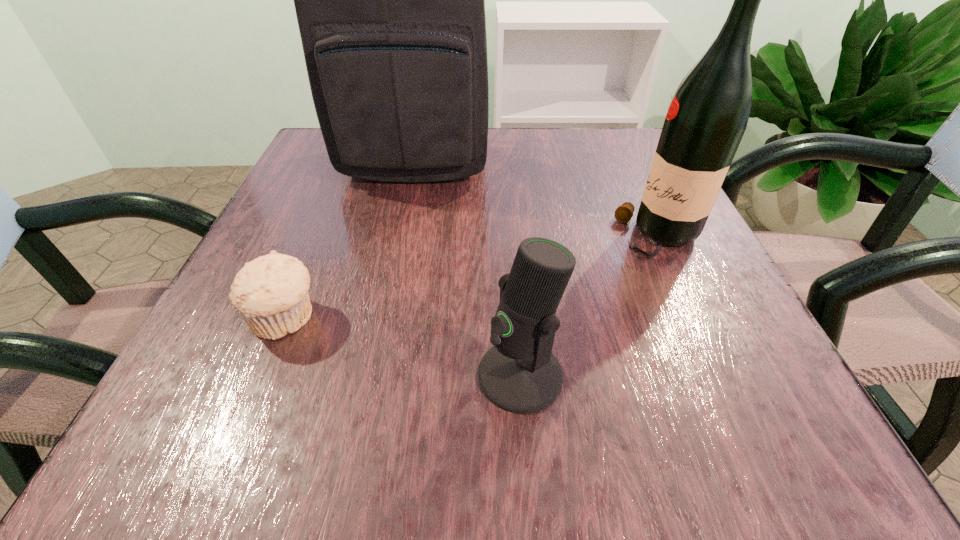
Locate an element on the screen. The image size is (960, 540). the tallest object is located at coordinates (390, 0).

Where is `backpack`? Image resolution: width=960 pixels, height=540 pixels. backpack is located at coordinates (390, 0).

I want to click on the second tallest object, so click(705, 122).

Find the location of `wine bottle`. wine bottle is located at coordinates (705, 122).

Where is `microphone`? microphone is located at coordinates (520, 374).

In order to click on muffin in this screenshot , I will do `click(270, 293)`.

Where is `vacant space located 0.250m on the front-facing side of the backpack`? The image size is (960, 540). vacant space located 0.250m on the front-facing side of the backpack is located at coordinates (390, 286).

Locate an element on the screen. blank space located on the back of the third nearest object is located at coordinates [x=614, y=138].

Locate an element on the screen. This screenshot has width=960, height=540. vacant space located 0.330m on the left of the second shortest object is located at coordinates (218, 375).

At what (x,y) coordinates should I click in order to perform the action: click on free space located on the back of the shortest object. Please return your answer as a coordinate pair (x, y). Looking at the image, I should click on (350, 162).